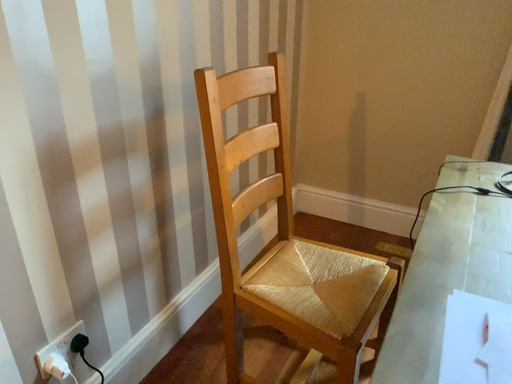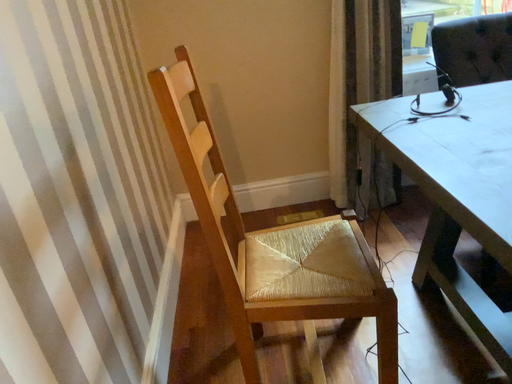
Question: How did the camera likely rotate when shooting the video?

Choices:
 (A) rotated left
 (B) rotated right

Answer: (B)